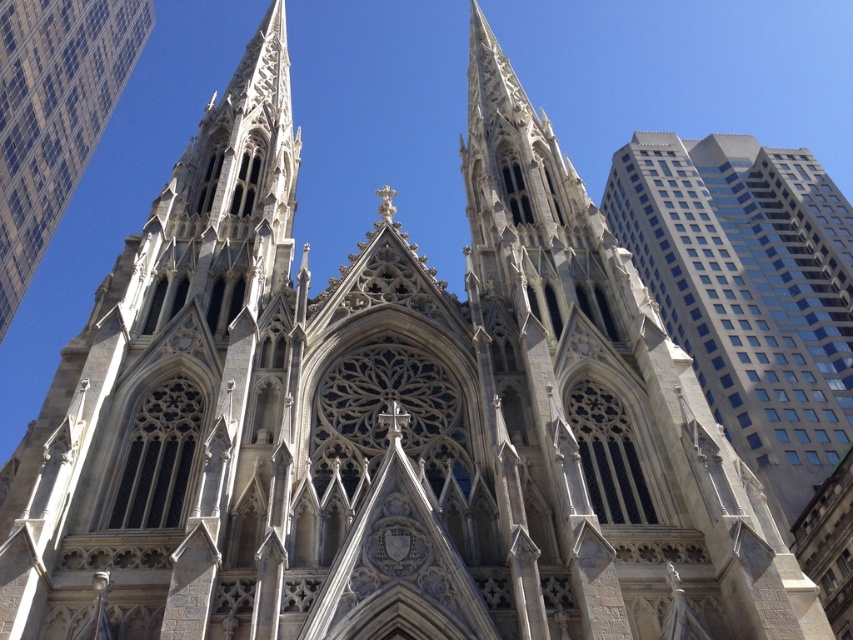
You are standing in front of St. Patrick Cathedral and want to take a photo of both the glassy reflective skyscraper at right and the white stone tower at upper left. Which object should you focus on first to ensure both are in frame?

You should focus on the glassy reflective skyscraper at right first since it is closer to the viewer than the white stone tower at upper left, allowing you to adjust the camera to include both in the frame.

You are a photographer planning to capture the entire facade of St. Patrick Cathedral in New York City. You notice a glassy reflective skyscraper at right and a white stone tower at upper left in your current view. Which object is wider in your camera frame?

The glassy reflective skyscraper at right is wider than the white stone tower at upper left.